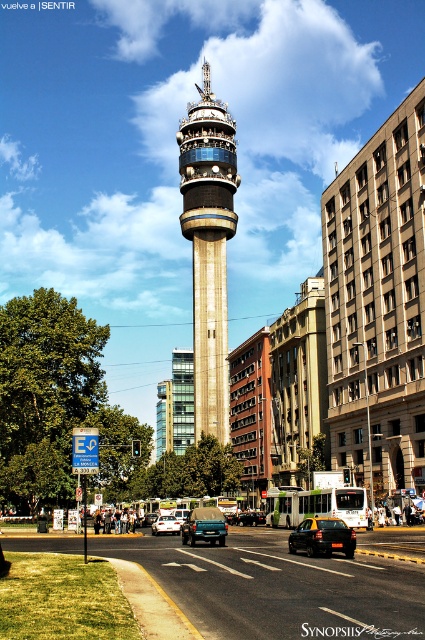
Does matte glass control tower at center come behind metallic silver sedan at center?

Yes, matte glass control tower at center is further from the viewer.

Between matte glass control tower at center and metallic silver sedan at center, which one has more height?

Standing taller between the two is matte glass control tower at center.

Does point (187, 168) lie behind point (173, 524)?

Yes, point (187, 168) is behind point (173, 524).

Find the location of `matte glass control tower at center`. matte glass control tower at center is located at coordinates (209, 248).

How far apart are black matte car at center and matte blue car at center?

They are 9.36 meters apart.

Does point (299, 532) come closer to viewer compared to point (189, 524)?

Yes, point (299, 532) is in front of point (189, 524).

Who is more forward, (x=303, y=540) or (x=200, y=512)?

Point (x=303, y=540) is in front.

You are a GUI agent. You are given a task and a screenshot of the screen. Output one action in this format:
    pyautogui.click(x=<x>, y=<y>)
    Task: Click on the black matte car at center
    
    Given the screenshot: What is the action you would take?
    pyautogui.click(x=323, y=536)

Between matte blue car at center and matte black car at center, which one appears on the left side from the viewer's perspective?

From the viewer's perspective, matte blue car at center appears more on the left side.

From the picture: Does matte blue car at center have a lesser width compared to matte black car at center?

No, matte blue car at center is not thinner than matte black car at center.

In order to click on matte blue car at center in this screenshot , I will do `click(204, 525)`.

Image resolution: width=425 pixels, height=640 pixels. Identify the location of matte blue car at center. [x=204, y=525].